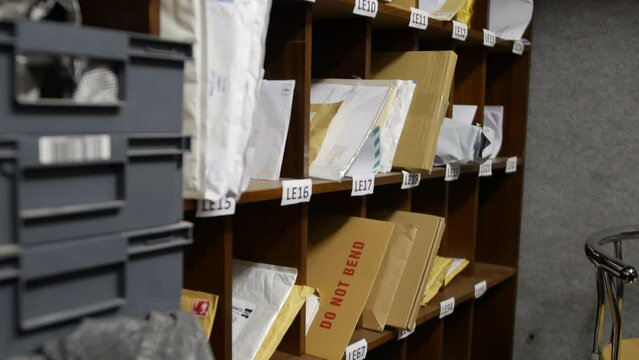
Where is `chair`? Image resolution: width=639 pixels, height=360 pixels. chair is located at coordinates (619, 334).